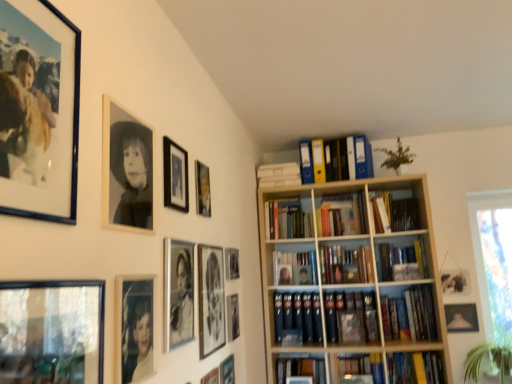
Question: Considering the relative sizes of matte black picture frame at upper center, the 11th picture frame positioned from the left, and hardcover book at center, placed as the 3th book when sorted from bottom to top, in the image provided, is matte black picture frame at upper center, the 11th picture frame positioned from the left, thinner than hardcover book at center, placed as the 3th book when sorted from bottom to top,?

Choices:
 (A) yes
 (B) no

Answer: (A)

Question: Considering the relative sizes of matte black picture frame at upper center, the 11th picture frame positioned from the left, and hardcover book at center, the third book from the top, in the image provided, is matte black picture frame at upper center, the 11th picture frame positioned from the left, smaller than hardcover book at center, the third book from the top,?

Choices:
 (A) no
 (B) yes

Answer: (B)

Question: Is matte black picture frame at upper center, the 3th picture frame in the right-to-left sequence, directly adjacent to hardcover book at center, the third book from the top?

Choices:
 (A) no
 (B) yes

Answer: (A)

Question: Is matte black picture frame at upper center, the 11th picture frame positioned from the left, positioned far away from hardcover book at center, the third book from the top?

Choices:
 (A) no
 (B) yes

Answer: (B)

Question: Does matte black picture frame at upper center, the 3th picture frame in the right-to-left sequence, have a greater height compared to hardcover book at center, the third book from the top?

Choices:
 (A) yes
 (B) no

Answer: (B)

Question: From the image's perspective, is matte black picture frame at upper center, the 11th picture frame positioned from the left, beneath hardcover book at center, the third book from the top?

Choices:
 (A) no
 (B) yes

Answer: (A)

Question: Considering the relative positions of green leafy plant at lower right, marked as the 2th plant in a top-to-bottom arrangement, and matte gold picture frame at lower right, which is the first picture frame from right to left, in the image provided, is green leafy plant at lower right, marked as the 2th plant in a top-to-bottom arrangement, to the left of matte gold picture frame at lower right, which is the first picture frame from right to left, from the viewer's perspective?

Choices:
 (A) no
 (B) yes

Answer: (A)

Question: Is green leafy plant at lower right, marked as the 1th plant in a bottom-to-top arrangement, outside matte gold picture frame at lower right, the 13th picture frame when ordered from left to right?

Choices:
 (A) no
 (B) yes

Answer: (B)

Question: Would you say matte gold picture frame at lower right, which is the first picture frame from right to left, is part of green leafy plant at lower right, marked as the 2th plant in a top-to-bottom arrangement,'s contents?

Choices:
 (A) no
 (B) yes

Answer: (A)

Question: Is green leafy plant at lower right, the 2th plant from the left, shorter than matte gold picture frame at lower right, which is the first picture frame from right to left?

Choices:
 (A) no
 (B) yes

Answer: (A)

Question: Can you confirm if green leafy plant at lower right, marked as the 1th plant in a right-to-left arrangement, is thinner than matte gold picture frame at lower right, which is the first picture frame from right to left?

Choices:
 (A) no
 (B) yes

Answer: (A)

Question: Considering the relative positions of green leafy plant at lower right, marked as the 1th plant in a bottom-to-top arrangement, and matte gold picture frame at lower right, the 13th picture frame when ordered from left to right, in the image provided, is green leafy plant at lower right, marked as the 1th plant in a bottom-to-top arrangement, to the right of matte gold picture frame at lower right, the 13th picture frame when ordered from left to right, from the viewer's perspective?

Choices:
 (A) yes
 (B) no

Answer: (A)

Question: From a real-world perspective, is matte gold picture frame at lower right, the 13th picture frame when ordered from left to right, located higher than green leafy plant at lower right, marked as the 2th plant in a top-to-bottom arrangement?

Choices:
 (A) yes
 (B) no

Answer: (A)